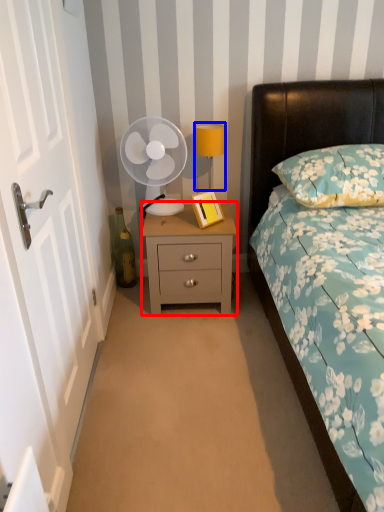
Question: Which object appears closest to the camera in this image, nightstand (highlighted by a red box) or bedside lamp (highlighted by a blue box)?

Choices:
 (A) nightstand
 (B) bedside lamp

Answer: (A)